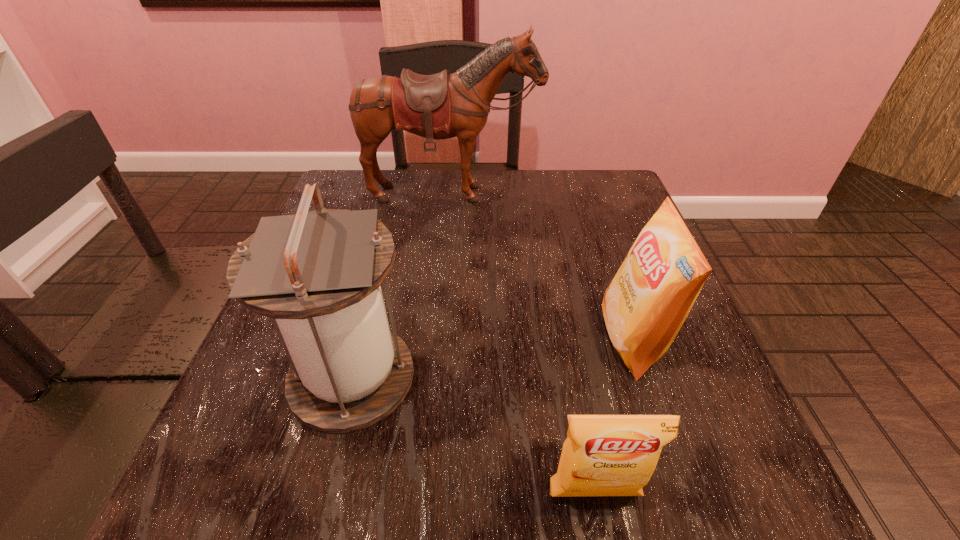
The width and height of the screenshot is (960, 540). In order to click on the farthest object in this screenshot , I will do `click(440, 106)`.

Identify the location of the tallest object. This screenshot has height=540, width=960. (440, 106).

Locate an element on the screen. The width and height of the screenshot is (960, 540). lantern is located at coordinates (317, 274).

Locate an element on the screen. Image resolution: width=960 pixels, height=540 pixels. the farther crisp (potato chip) is located at coordinates (645, 305).

In order to click on the rightmost object in this screenshot , I will do `click(645, 305)`.

The width and height of the screenshot is (960, 540). In order to click on the shortest object in this screenshot , I will do `click(604, 455)`.

Where is `the left crisp (potato chip)`? the left crisp (potato chip) is located at coordinates (604, 455).

Locate an element on the screen. vacant space located 0.180m on the back of the farthest object is located at coordinates point(446,255).

Where is `vacant space located 0.240m on the back of the lantern`? vacant space located 0.240m on the back of the lantern is located at coordinates (386, 246).

The width and height of the screenshot is (960, 540). Find the location of `vacant space situated on the front-facing side of the taller crisp (potato chip)`. vacant space situated on the front-facing side of the taller crisp (potato chip) is located at coordinates (444, 340).